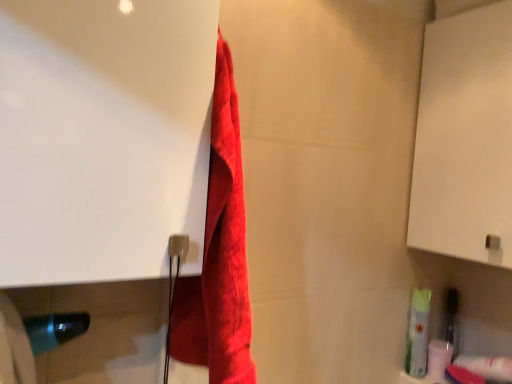
Question: Relative to white matte toilet paper at lower right, arranged as the first toilet paper when viewed from the back, is white glossy screen door at upper left, the second screen door in the right-to-left sequence, in front or behind?

Choices:
 (A) behind
 (B) front

Answer: (B)

Question: Choose the correct answer: Is white glossy screen door at upper left, which ranks as the first screen door in front-to-back order, inside white matte toilet paper at lower right, arranged as the first toilet paper when viewed from the back, or outside it?

Choices:
 (A) outside
 (B) inside

Answer: (A)

Question: Which object is positioned closest to the white glossy screen door at upper left, which ranks as the first screen door in front-to-back order?

Choices:
 (A) white matte cabinet at upper right, the first screen door from the right
 (B) red fluffy towel at center
 (C) white matte toilet paper at lower right, the 2th toilet paper viewed from the front
 (D) white matte toilet paper at lower right, marked as the 1th toilet paper in a front-to-back arrangement

Answer: (B)

Question: Which object is the closest to the white matte toilet paper at lower right, arranged as the first toilet paper when viewed from the back?

Choices:
 (A) red fluffy towel at center
 (B) white glossy screen door at upper left, arranged as the second screen door when viewed from the back
 (C) white matte toilet paper at lower right, marked as the 1th toilet paper in a front-to-back arrangement
 (D) white matte cabinet at upper right, which appears as the first screen door when viewed from the back

Answer: (C)